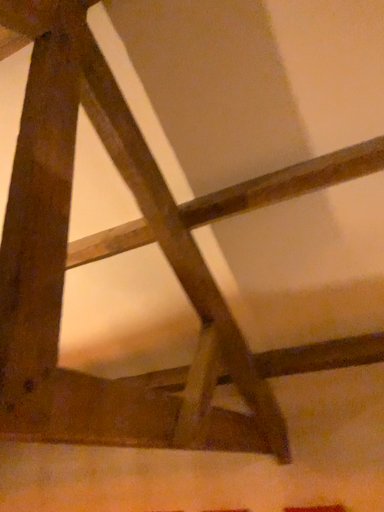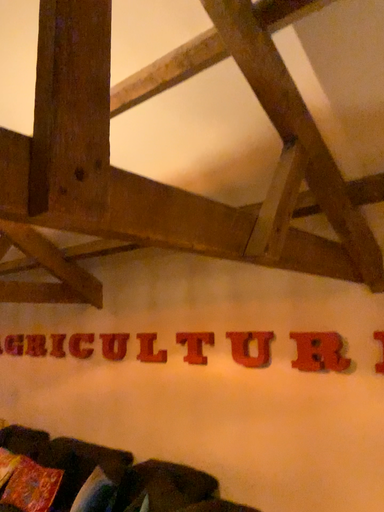
Question: Which way did the camera rotate in the video?

Choices:
 (A) rotated left
 (B) rotated right

Answer: (A)